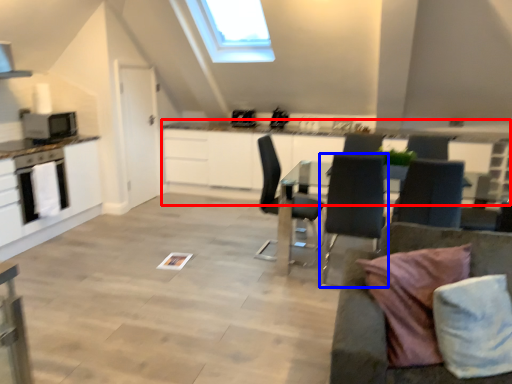
Question: Which object is further to the camera taking this photo, counter (highlighted by a red box) or chair (highlighted by a blue box)?

Choices:
 (A) counter
 (B) chair

Answer: (A)